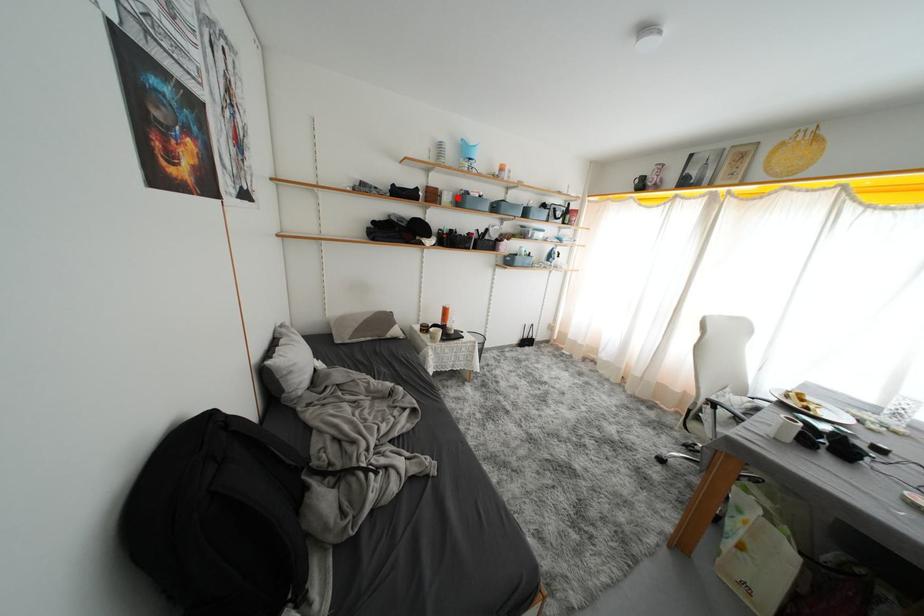
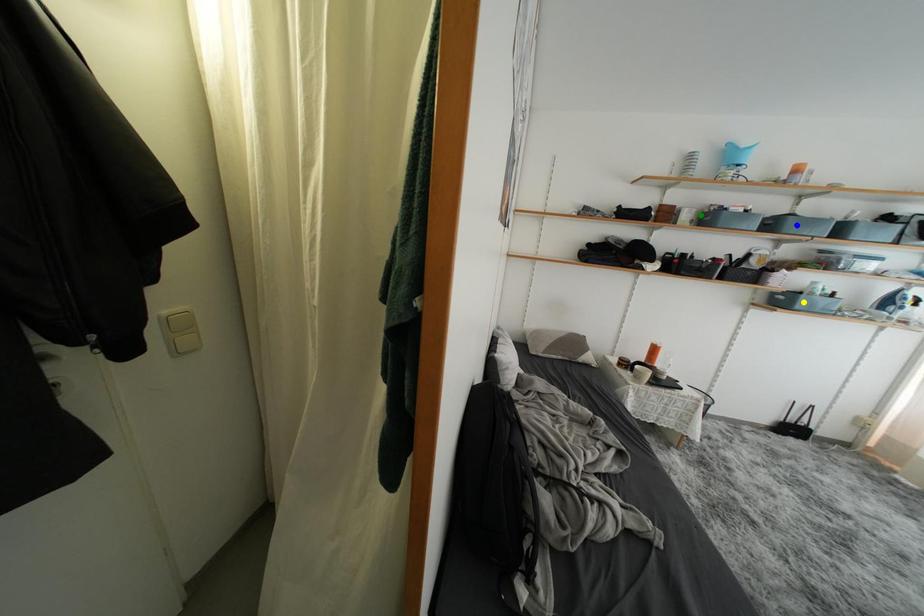
Question: I am providing you with two images of the same scene from different viewpoints. A red point is marked on the first image. You are given multiple points on the second image. Which point in image 2 represents the same 3d spot as the red point in image 1?

Choices:
 (A) yellow point
 (B) blue point
 (C) green point

Answer: (C)